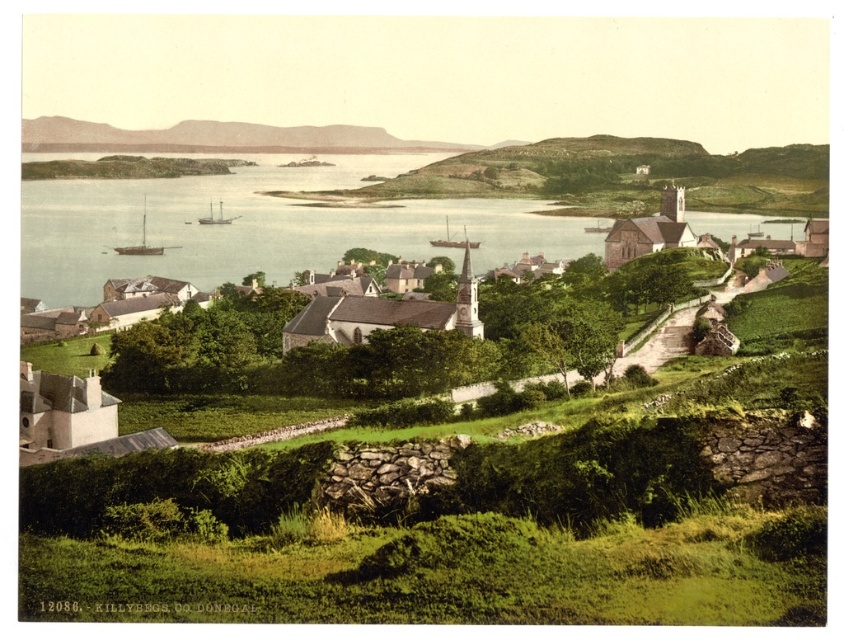
Question: Estimate the real-world distances between objects in this image. Which object is closer to the blue water at center?

Choices:
 (A) wooden sailboat at left
 (B) wooden sailboat at center

Answer: (A)

Question: Does blue water at center have a greater width compared to wooden sailboat at left?

Choices:
 (A) yes
 (B) no

Answer: (A)

Question: Does rustic stone wall at upper center have a smaller size compared to wooden sailboat at left?

Choices:
 (A) no
 (B) yes

Answer: (A)

Question: Based on their relative distances, which object is farther from the wooden sailboat at center?

Choices:
 (A) wooden sailboat at left
 (B) rustic stone wall at upper center

Answer: (B)

Question: Which object is farther from the camera taking this photo?

Choices:
 (A) white wooden ship at center-left
 (B) wooden sailboat at left

Answer: (A)

Question: Is blue water at center positioned in front of rustic stone wall at upper center?

Choices:
 (A) yes
 (B) no

Answer: (A)